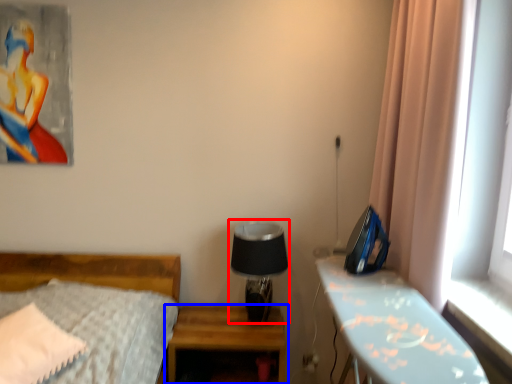
Question: Which of the following is the closest to the observer, table lamp (highlighted by a red box) or nightstand (highlighted by a blue box)?

Choices:
 (A) table lamp
 (B) nightstand

Answer: (B)